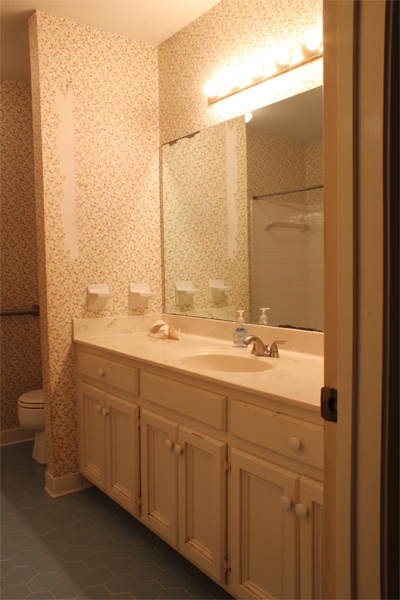
Identify the location of light fixture. (211, 90), (231, 80), (256, 65), (278, 56), (312, 43).